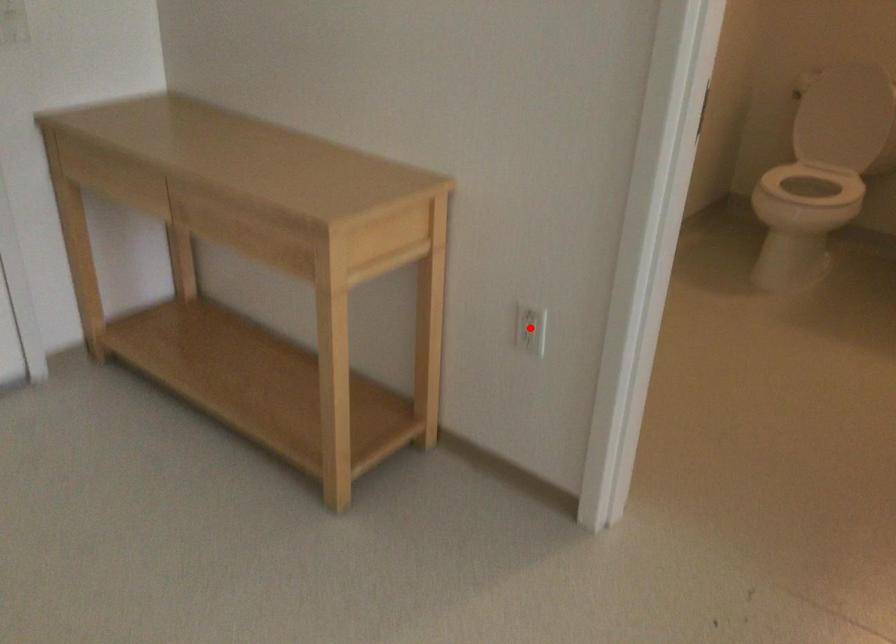
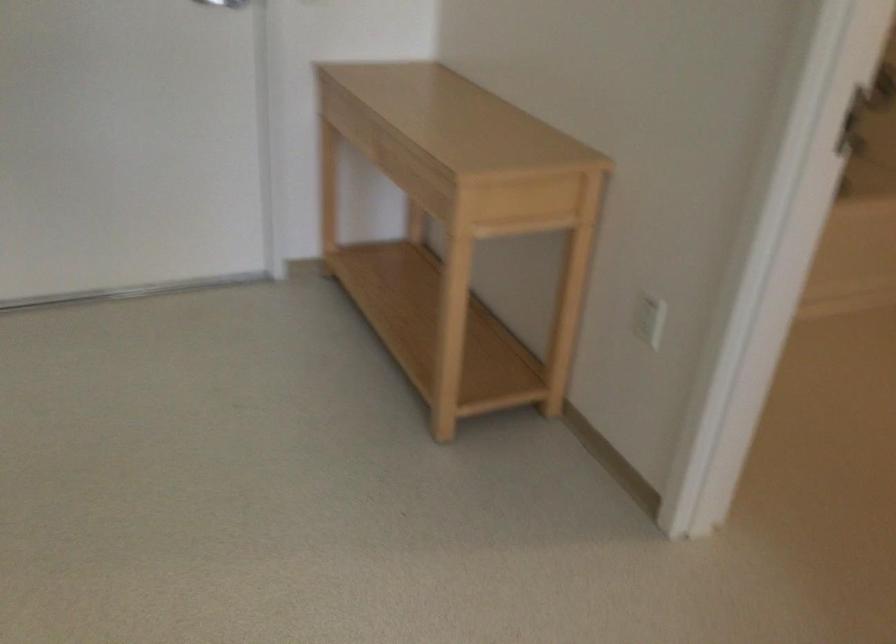
In the second image, find the point that corresponds to the highlighted location in the first image.

(648, 317)